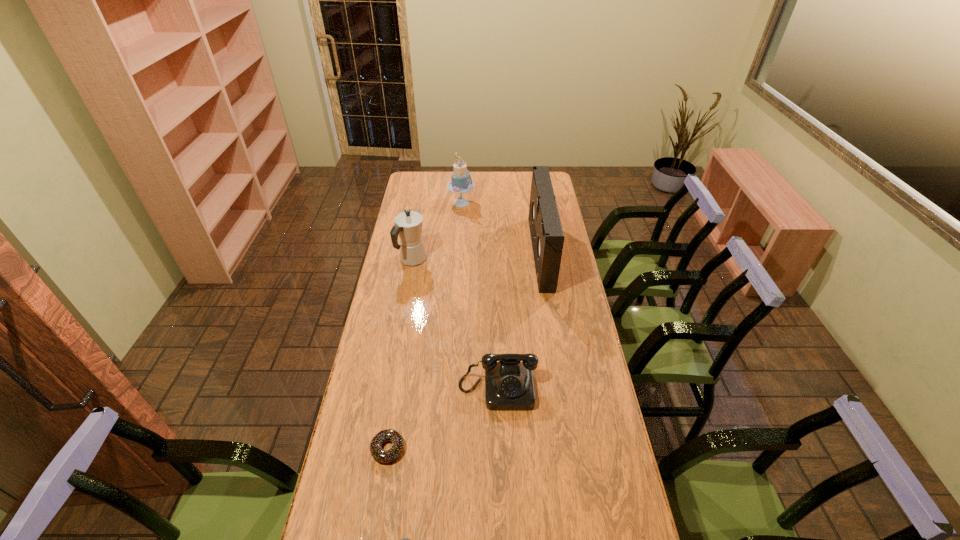
You are a GUI agent. You are given a task and a screenshot of the screen. Output one action in this format:
    pyautogui.click(x=<x>, y=<y>)
    Task: Click on the object that stands as the third closest to the videotape
    Image resolution: width=960 pixels, height=540 pixels.
    Given the screenshot: What is the action you would take?
    pyautogui.click(x=408, y=225)

Image resolution: width=960 pixels, height=540 pixels. Identify the location of free space that satisfies the following two spatial constraints: 1. on the side of the videotape with visible spindles; 2. on the front side of the coffeepot. click(x=541, y=260).